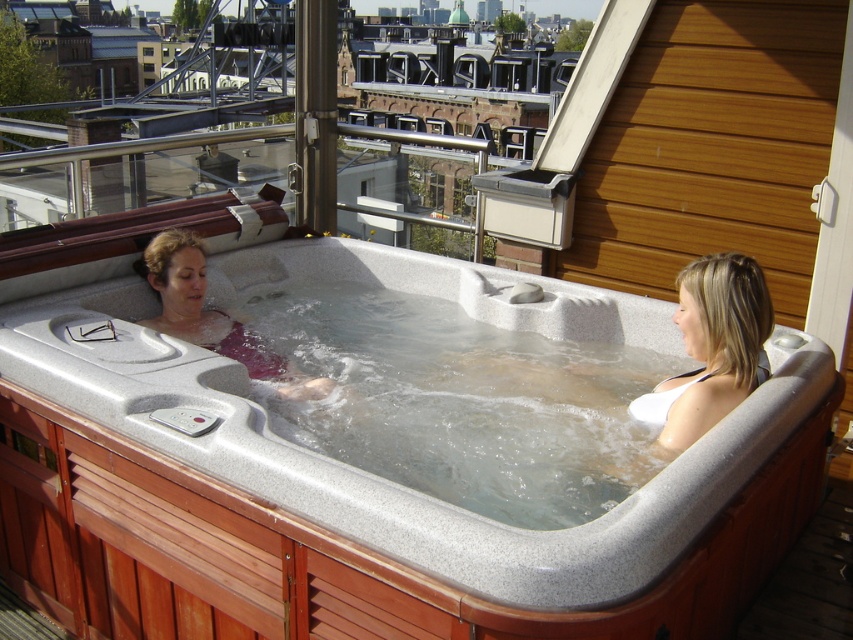
Question: Which point is farther from the camera taking this photo?

Choices:
 (A) (137, 428)
 (B) (148, 323)
 (C) (709, 320)

Answer: (B)

Question: Does smooth gray hot tub at center appear over white matte bikini at upper right?

Choices:
 (A) yes
 (B) no

Answer: (B)

Question: Is smooth gray hot tub at center positioned at the back of matte pink fabric at center?

Choices:
 (A) yes
 (B) no

Answer: (B)

Question: Does smooth gray hot tub at center have a larger size compared to matte pink fabric at center?

Choices:
 (A) yes
 (B) no

Answer: (A)

Question: Which point appears farthest from the camera in this image?

Choices:
 (A) (198, 310)
 (B) (726, 497)

Answer: (A)

Question: Which of these objects is positioned farthest from the matte pink fabric at center?

Choices:
 (A) white matte bikini at upper right
 (B) smooth gray hot tub at center

Answer: (A)